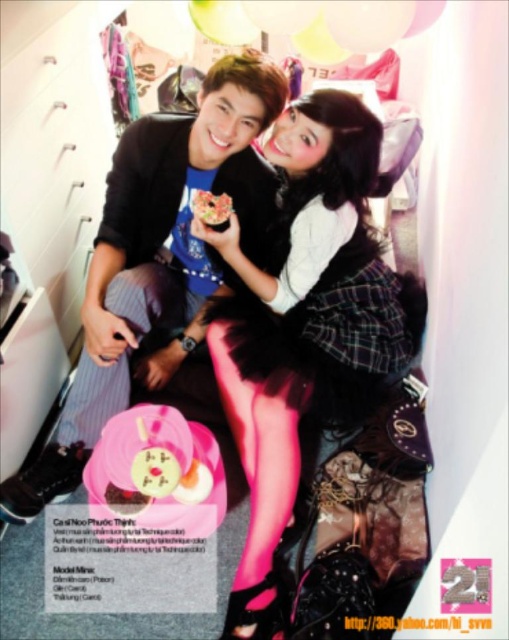
You are a photographer trying to capture a closeup shot of the pink tulle skirt at center. Your camera is set to a focal length that requires the subject to be at least 1.20 meters away. Can you take the photo with the current camera settings?

The pink tulle skirt at center and camera are 1.20 meters apart, so yes, the camera can take the photo since the distance meets the minimum requirement of 1.20 meters.

You are organizing a fashion show and need to decide which outfit piece takes up more space on the runway. Based on the image, which one is bigger between the pink tulle skirt at center and the matte black sweater at center?

The pink tulle skirt at center is larger in size than the matte black sweater at center, so the pink tulle skirt at center takes up more space on the runway.